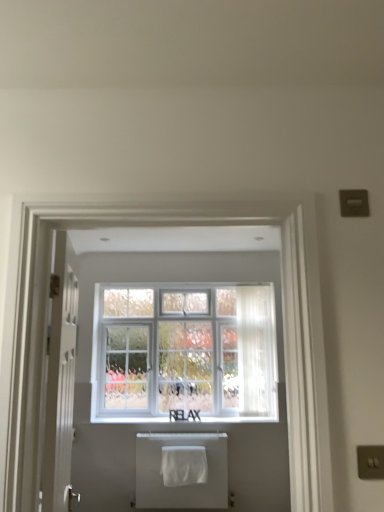
The image size is (384, 512). What do you see at coordinates (186, 351) in the screenshot? I see `white textured window at center` at bounding box center [186, 351].

Where is `white matte window sill at center`? The width and height of the screenshot is (384, 512). white matte window sill at center is located at coordinates (190, 418).

Describe the element at coordinates (370, 462) in the screenshot. Image resolution: width=384 pixels, height=512 pixels. I see `satin gold switch at lower right` at that location.

The image size is (384, 512). Find the location of `white fabric bath towel at lower center, which ranks as the first bath towel in front-to-back order`. white fabric bath towel at lower center, which ranks as the first bath towel in front-to-back order is located at coordinates (184, 465).

What do you see at coordinates (184, 465) in the screenshot?
I see `white fabric bath towel at lower center, which ranks as the first bath towel in front-to-back order` at bounding box center [184, 465].

Locate an element on the screen. This screenshot has width=384, height=512. white textured window at center is located at coordinates (186, 351).

Is white cotton bath towel at lower center, the 2th bath towel in the front-to-back sequence, surrounding white glossy door at left?

No, white glossy door at left is not a part of white cotton bath towel at lower center, the 2th bath towel in the front-to-back sequence.

From the image's perspective, is white cotton bath towel at lower center, which is counted as the first bath towel, starting from the back, below white glossy door at left?

Yes, from the image's perspective, white cotton bath towel at lower center, which is counted as the first bath towel, starting from the back, is below white glossy door at left.

From a real-world perspective, is white cotton bath towel at lower center, which is counted as the first bath towel, starting from the back, above or below white glossy door at left?

From a real-world perspective, white cotton bath towel at lower center, which is counted as the first bath towel, starting from the back, is physically below white glossy door at left.

Considering the positions of objects white cotton bath towel at lower center, the 2th bath towel in the front-to-back sequence, and white glossy door at left in the image provided, who is more to the left, white cotton bath towel at lower center, the 2th bath towel in the front-to-back sequence, or white glossy door at left?

white glossy door at left is more to the left.

Is there a large distance between white textured window at center and white glossy door at left?

Yes, white textured window at center and white glossy door at left are quite far apart.

Is white textured window at center oriented away from white glossy door at left?

That's not correct — white textured window at center is not looking away from white glossy door at left.

Considering the points (271, 369) and (51, 434), which point is behind, point (271, 369) or point (51, 434)?

Point (271, 369)

From the image's perspective, is white textured window at center located beneath white glossy door at left?

Yes.

From the image's perspective, would you say white matte window sill at center is shown under white glossy door at left?

Indeed, from the image's perspective, white matte window sill at center is shown beneath white glossy door at left.

Would you say white matte window sill at center contains white glossy door at left?

No, white glossy door at left is not a part of white matte window sill at center.

Considering the positions of objects white matte window sill at center and white glossy door at left in the image provided, who is in front, white matte window sill at center or white glossy door at left?

white glossy door at left.

Would you say white matte window sill at center is to the left or to the right of white glossy door at left in the picture?

white matte window sill at center is to the right of white glossy door at left.

Which is farther, (51,353) or (374,469)?

The point (51,353) is more distant.

Can you tell me how much white glossy door at left and satin gold switch at lower right differ in facing direction?

102 degrees.

Based on the photo, does white glossy door at left appear on the left side of satin gold switch at lower right?

Yes.

Is satin gold switch at lower right a part of white glossy door at left?

No, satin gold switch at lower right is not surrounded by white glossy door at left.

Can you see white fabric bath towel at lower center, which ranks as the first bath towel in front-to-back order, touching satin gold switch at lower right?

There is a gap between white fabric bath towel at lower center, which ranks as the first bath towel in front-to-back order, and satin gold switch at lower right.

Can you tell me how much white fabric bath towel at lower center, which is the second bath towel in back-to-front order, and satin gold switch at lower right differ in facing direction?

white fabric bath towel at lower center, which is the second bath towel in back-to-front order, and satin gold switch at lower right are facing 0.17 degrees away from each other.

Is point (191, 452) in front of point (367, 479)?

No, (191, 452) is behind (367, 479).

Consider the image. Considering the relative positions of white fabric bath towel at lower center, which is the second bath towel in back-to-front order, and satin gold switch at lower right in the image provided, is white fabric bath towel at lower center, which is the second bath towel in back-to-front order, in front of satin gold switch at lower right?

No, white fabric bath towel at lower center, which is the second bath towel in back-to-front order, is further to the viewer.

Between white fabric bath towel at lower center, which ranks as the first bath towel in front-to-back order, and white matte window sill at center, which one is positioned behind?

white matte window sill at center is further from the camera.

Consider the image. Which is correct: white fabric bath towel at lower center, which ranks as the first bath towel in front-to-back order, is inside white matte window sill at center, or outside of it?

white fabric bath towel at lower center, which ranks as the first bath towel in front-to-back order, is not inside white matte window sill at center, it's outside.

Is white fabric bath towel at lower center, which is the second bath towel in back-to-front order, shorter than white matte window sill at center?

In fact, white fabric bath towel at lower center, which is the second bath towel in back-to-front order, may be taller than white matte window sill at center.

Between white fabric bath towel at lower center, which is the second bath towel in back-to-front order, and white matte window sill at center, which one appears on the right side from the viewer's perspective?

white fabric bath towel at lower center, which is the second bath towel in back-to-front order, is more to the right.

Which object is positioned more to the left, white textured window at center or satin gold switch at lower right?

→ From the viewer's perspective, white textured window at center appears more on the left side.

From a real-world perspective, does white textured window at center sit lower than satin gold switch at lower right?

No, from a real-world perspective, white textured window at center is not under satin gold switch at lower right.

Which of these two, white textured window at center or satin gold switch at lower right, is thinner?

With smaller width is satin gold switch at lower right.

Which object is more forward, white textured window at center or satin gold switch at lower right?

satin gold switch at lower right is in front.

Where is `the 1st bath towel counting from the right side of the white glossy door at left`? the 1st bath towel counting from the right side of the white glossy door at left is located at coordinates (181, 470).

In the image, there is a white glossy door at left. Identify the location of window below it (from the image's perspective). This screenshot has height=512, width=384. (186, 351).

Looking at the image, which one is located further to white textured window at center, white fabric bath towel at lower center, which is the second bath towel in back-to-front order, or satin gold switch at lower right?

satin gold switch at lower right is further to white textured window at center.

Estimate the real-world distances between objects in this image. Which object is closer to white glossy door at left, white cotton bath towel at lower center, the 2th bath towel in the front-to-back sequence, or satin gold switch at lower right?

The object closer to white glossy door at left is satin gold switch at lower right.

From the image, which object appears to be nearer to white textured window at center, satin gold switch at lower right or white cotton bath towel at lower center, which is counted as the first bath towel, starting from the back?

The object closer to white textured window at center is white cotton bath towel at lower center, which is counted as the first bath towel, starting from the back.

From the image, which object appears to be nearer to satin gold switch at lower right, white matte window sill at center or white glossy door at left?

white glossy door at left.

Consider the image. When comparing their distances from white glossy door at left, does white cotton bath towel at lower center, the 2th bath towel in the front-to-back sequence, or white fabric bath towel at lower center, which ranks as the first bath towel in front-to-back order, seem further?

white cotton bath towel at lower center, the 2th bath towel in the front-to-back sequence, lies further to white glossy door at left than the other object.

Considering their positions, is white textured window at center positioned further to white glossy door at left than white matte window sill at center?

white matte window sill at center is positioned further to the anchor white glossy door at left.

Estimate the real-world distances between objects in this image. Which object is closer to white fabric bath towel at lower center, which ranks as the first bath towel in front-to-back order, white textured window at center or white glossy door at left?

Based on the image, white textured window at center appears to be nearer to white fabric bath towel at lower center, which ranks as the first bath towel in front-to-back order.

Consider the image. Which object lies nearer to the anchor point white matte window sill at center, white textured window at center or white fabric bath towel at lower center, which is the second bath towel in back-to-front order?

white fabric bath towel at lower center, which is the second bath towel in back-to-front order, lies closer to white matte window sill at center than the other object.

Image resolution: width=384 pixels, height=512 pixels. What are the coordinates of `window sill between white textured window at center and white fabric bath towel at lower center, which ranks as the first bath towel in front-to-back order, from top to bottom` in the screenshot? It's located at (190, 418).

Locate an element on the screen. The width and height of the screenshot is (384, 512). bath towel between white textured window at center and white cotton bath towel at lower center, the 2th bath towel in the front-to-back sequence, from top to bottom is located at coordinates (184, 465).

This screenshot has width=384, height=512. I want to click on door between satin gold switch at lower right and white fabric bath towel at lower center, which ranks as the first bath towel in front-to-back order, from front to back, so pos(60,383).

Identify the location of bath towel between white matte window sill at center and white cotton bath towel at lower center, the 2th bath towel in the front-to-back sequence, in the vertical direction. (184, 465).